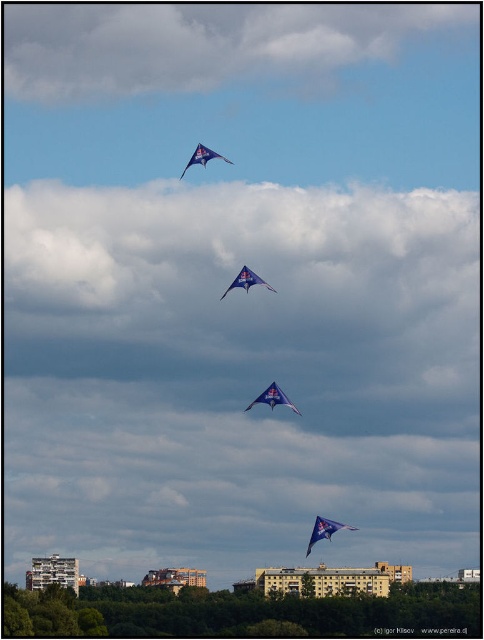
Who is more forward, (231,282) or (218,154)?

Point (231,282) is in front.

Can you confirm if blue glossy kite at center is positioned below blue fabric kite at upper center?

Correct, blue glossy kite at center is located below blue fabric kite at upper center.

From the picture: Who is more forward, (x=230, y=285) or (x=200, y=154)?

Point (x=230, y=285) is in front.

Locate an element on the screen. This screenshot has height=640, width=484. blue glossy kite at center is located at coordinates (246, 280).

Does blue fabric kite at center have a smaller size compared to blue fabric kite at upper center?

Correct, blue fabric kite at center occupies less space than blue fabric kite at upper center.

From the picture: Between blue fabric kite at center and blue fabric kite at upper center, which one is positioned lower?

blue fabric kite at center is below.

Which is in front, point (262, 401) or point (202, 147)?

Point (262, 401) is more forward.

Locate an element on the screen. blue fabric kite at center is located at coordinates (272, 397).

Who is positioned more to the left, blue fabric kite at lower center or blue fabric kite at upper center?

Positioned to the left is blue fabric kite at upper center.

Locate an element on the screen. The width and height of the screenshot is (484, 640). blue fabric kite at lower center is located at coordinates (324, 531).

Which is behind, point (323, 529) or point (186, 168)?

The point (323, 529) is more distant.

Where is `blue fabric kite at lower center`? blue fabric kite at lower center is located at coordinates (324, 531).